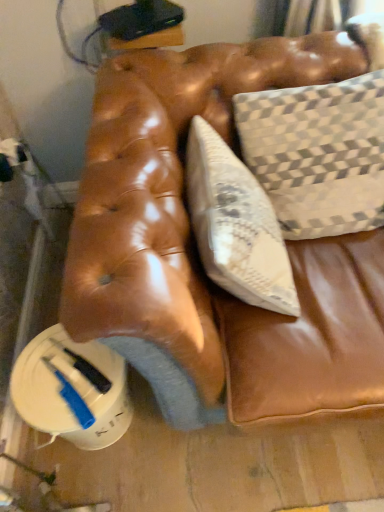
The image size is (384, 512). What do you see at coordinates (197, 253) in the screenshot? I see `leather couch cushion at center` at bounding box center [197, 253].

Identify the location of leather couch cushion at center. The image size is (384, 512). (197, 253).

What is the approximate width of textured beige pillow at upper right?

textured beige pillow at upper right is 8.13 inches in width.

What do you see at coordinates (318, 154) in the screenshot?
I see `textured beige pillow at upper right` at bounding box center [318, 154].

Find the location of a particular element. textured beige pillow at upper right is located at coordinates (318, 154).

Where is `leather couch cushion at center`? Image resolution: width=384 pixels, height=512 pixels. leather couch cushion at center is located at coordinates (197, 253).

Is textured beige pillow at upper right to the left or to the right of leather couch cushion at center in the image?

From the image, it's evident that textured beige pillow at upper right is to the right of leather couch cushion at center.

Relative to leather couch cushion at center, is textured beige pillow at upper right in front or behind?

Visually, textured beige pillow at upper right is located behind leather couch cushion at center.

Is point (329, 142) farther from viewer compared to point (85, 295)?

Yes, it is.

From the image's perspective, is textured beige pillow at upper right located above or below leather couch cushion at center?

From the image's perspective, textured beige pillow at upper right appears above leather couch cushion at center.

From a real-world perspective, is textured beige pillow at upper right located higher than leather couch cushion at center?

Yes, from a real-world perspective, textured beige pillow at upper right is above leather couch cushion at center.

Looking at their sizes, would you say textured beige pillow at upper right is wider or thinner than leather couch cushion at center?

In the image, textured beige pillow at upper right appears to be more narrow than leather couch cushion at center.

Consider the image. Can you confirm if textured beige pillow at upper right is shorter than leather couch cushion at center?

No, textured beige pillow at upper right is not shorter than leather couch cushion at center.

Between textured beige pillow at upper right and leather couch cushion at center, which one has smaller size?

textured beige pillow at upper right.

Is textured beige pillow at upper right inside or outside of leather couch cushion at center?

textured beige pillow at upper right is contained in leather couch cushion at center.

Is textured beige pillow at upper right placed right next to leather couch cushion at center?

They are not placed beside each other.

Is leather couch cushion at center at the back of textured beige pillow at upper right?

textured beige pillow at upper right is not turned away from leather couch cushion at center.

How many degrees apart are the facing directions of textured beige pillow at upper right and leather couch cushion at center?

textured beige pillow at upper right and leather couch cushion at center are facing 99.8 degrees away from each other.

Find the location of a particular element. pillow that appears above the leather couch cushion at center (from the image's perspective) is located at coordinates (318, 154).

Considering the relative positions of leather couch cushion at center and textured beige pillow at upper right in the image provided, is leather couch cushion at center to the right of textured beige pillow at upper right from the viewer's perspective?

In fact, leather couch cushion at center is to the left of textured beige pillow at upper right.

Which object is closer to the camera, leather couch cushion at center or textured beige pillow at upper right?

leather couch cushion at center is more forward.

Which is more distant, (x=138, y=281) or (x=345, y=187)?

The point (x=345, y=187) is more distant.

From the image's perspective, does leather couch cushion at center appear higher than textured beige pillow at upper right?

No.

From a real-world perspective, which object rests below the other?

In real-world perspective, leather couch cushion at center is lower.

Is leather couch cushion at center wider or thinner than textured beige pillow at upper right?

In the image, leather couch cushion at center appears to be wider than textured beige pillow at upper right.

Can you confirm if leather couch cushion at center is taller than textured beige pillow at upper right?

In fact, leather couch cushion at center may be shorter than textured beige pillow at upper right.

Can you confirm if leather couch cushion at center is smaller than textured beige pillow at upper right?

Actually, leather couch cushion at center might be larger than textured beige pillow at upper right.

Could textured beige pillow at upper right be considered to be inside leather couch cushion at center?

Definitely not — textured beige pillow at upper right is not inside leather couch cushion at center.

Are leather couch cushion at center and textured beige pillow at upper right beside each other?

leather couch cushion at center and textured beige pillow at upper right are clearly separated.

Is leather couch cushion at center aimed at textured beige pillow at upper right?

Yes, leather couch cushion at center is oriented towards textured beige pillow at upper right.

What's the angular difference between leather couch cushion at center and textured beige pillow at upper right's facing directions?

99.8 degrees separate the facing orientations of leather couch cushion at center and textured beige pillow at upper right.

How far apart are leather couch cushion at center and textured beige pillow at upper right?

The distance of leather couch cushion at center from textured beige pillow at upper right is 7.93 inches.

The width and height of the screenshot is (384, 512). What are the coordinates of `pillow above the leather couch cushion at center (from the image's perspective)` in the screenshot? It's located at (318, 154).

Identify the location of furniture located underneath the textured beige pillow at upper right (from a real-world perspective). The height and width of the screenshot is (512, 384). (197, 253).

In order to click on pillow on the right side of leather couch cushion at center in this screenshot , I will do `click(318, 154)`.